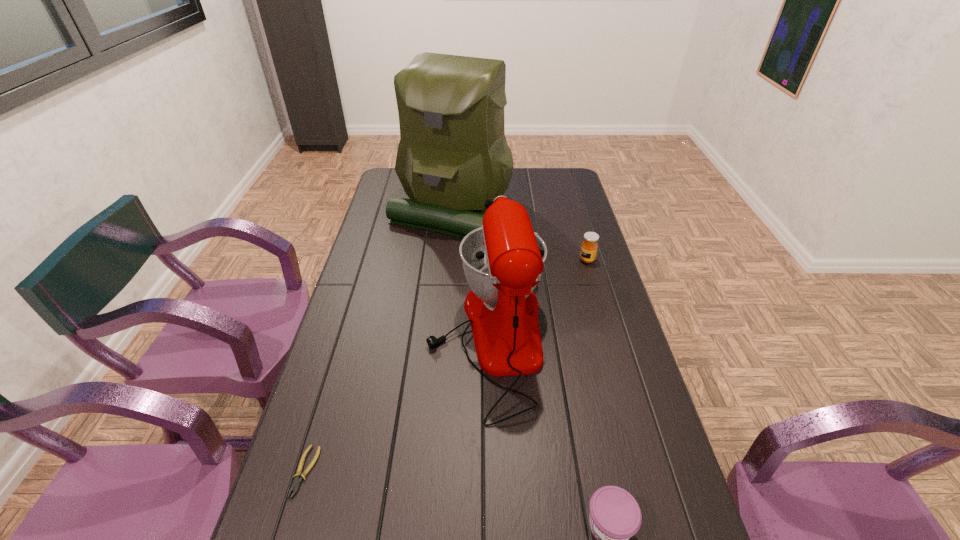
What are the coordinates of `vacant region located 0.070m on the bowl side of the fourth shortest object` in the screenshot? It's located at [404, 339].

In order to click on vacant space located 0.280m on the bowl side of the fourth shortest object in this screenshot , I will do `click(332, 339)`.

This screenshot has width=960, height=540. What are the coordinates of `free location located 0.230m on the front-facing side of the third shortest object` in the screenshot? It's located at (514, 260).

Image resolution: width=960 pixels, height=540 pixels. I want to click on vacant space located 0.130m on the front-facing side of the third shortest object, so click(542, 260).

This screenshot has height=540, width=960. Find the location of `free space located 0.360m on the front-facing side of the third shortest object`. free space located 0.360m on the front-facing side of the third shortest object is located at coordinates (477, 260).

Where is `free space located on the front of the shortest object`? The width and height of the screenshot is (960, 540). free space located on the front of the shortest object is located at coordinates (289, 525).

Identify the location of object located at the far edge. [453, 155].

Locate an element on the screen. This screenshot has height=540, width=960. backpack present at the left edge is located at coordinates (453, 155).

The height and width of the screenshot is (540, 960). Identify the location of pliers that is at the left edge. (296, 484).

You are a GUI agent. You are given a task and a screenshot of the screen. Output one action in this format:
    pyautogui.click(x=<x>, y=<y>)
    Task: Click on the object located in the right edge section of the desktop
    
    Given the screenshot: What is the action you would take?
    pyautogui.click(x=589, y=247)